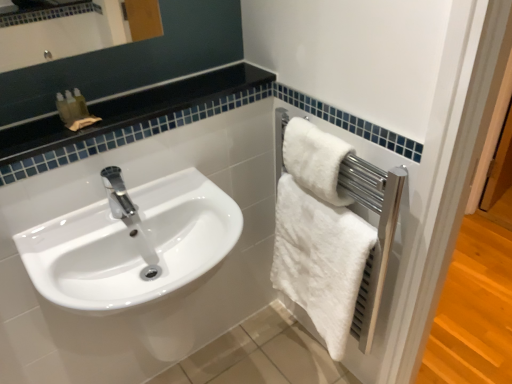
Question: From the image's perspective, is white fluffy towel at right, the first towel in the top-to-bottom sequence, beneath white glossy sink at left?

Choices:
 (A) no
 (B) yes

Answer: (A)

Question: Is white fluffy towel at right, which is counted as the 2th towel, starting from the bottom, taller than white glossy sink at left?

Choices:
 (A) yes
 (B) no

Answer: (B)

Question: From the image's perspective, is white fluffy towel at right, which is counted as the 2th towel, starting from the bottom, located above white glossy sink at left?

Choices:
 (A) yes
 (B) no

Answer: (A)

Question: From a real-world perspective, is white fluffy towel at right, which is counted as the 2th towel, starting from the bottom, beneath white glossy sink at left?

Choices:
 (A) no
 (B) yes

Answer: (A)

Question: Is white fluffy towel at right, the first towel in the top-to-bottom sequence, at the right side of white glossy sink at left?

Choices:
 (A) yes
 (B) no

Answer: (A)

Question: In the image, is white fluffy towel at right, which is counted as the 2th towel, starting from the bottom, positioned in front of or behind white fluffy towel at right, the first towel ordered from the bottom?

Choices:
 (A) behind
 (B) front

Answer: (B)

Question: Considering the positions of white fluffy towel at right, the first towel in the top-to-bottom sequence, and white fluffy towel at right, the second towel from the top, in the image, is white fluffy towel at right, the first towel in the top-to-bottom sequence, wider or thinner than white fluffy towel at right, the second towel from the top,?

Choices:
 (A) thin
 (B) wide

Answer: (A)

Question: From a real-world perspective, is white fluffy towel at right, which is counted as the 2th towel, starting from the bottom, above or below white fluffy towel at right, the second towel from the top?

Choices:
 (A) below
 (B) above

Answer: (B)

Question: Is white fluffy towel at right, which is counted as the 2th towel, starting from the bottom, bigger or smaller than white fluffy towel at right, the second towel from the top?

Choices:
 (A) big
 (B) small

Answer: (B)

Question: Is white glossy sink at left inside the boundaries of white fluffy towel at right, the second towel from the top, or outside?

Choices:
 (A) outside
 (B) inside

Answer: (A)

Question: From the image's perspective, relative to white fluffy towel at right, the first towel ordered from the bottom, is white glossy sink at left above or below?

Choices:
 (A) below
 (B) above

Answer: (A)

Question: In terms of width, does white glossy sink at left look wider or thinner when compared to white fluffy towel at right, the second towel from the top?

Choices:
 (A) wide
 (B) thin

Answer: (A)

Question: Is white glossy sink at left taller or shorter than white fluffy towel at right, the second towel from the top?

Choices:
 (A) tall
 (B) short

Answer: (B)

Question: Considering the positions of white fluffy towel at right, the first towel in the top-to-bottom sequence, and white glossy sink at left in the image, is white fluffy towel at right, the first towel in the top-to-bottom sequence, taller or shorter than white glossy sink at left?

Choices:
 (A) tall
 (B) short

Answer: (B)

Question: Considering the positions of white fluffy towel at right, which is counted as the 2th towel, starting from the bottom, and white glossy sink at left in the image, is white fluffy towel at right, which is counted as the 2th towel, starting from the bottom, wider or thinner than white glossy sink at left?

Choices:
 (A) wide
 (B) thin

Answer: (B)